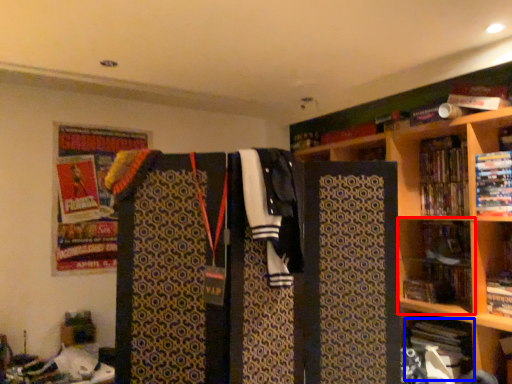
Question: Among these objects, which one is nearest to the camera, shelf (highlighted by a red box) or book (highlighted by a blue box)?

Choices:
 (A) shelf
 (B) book

Answer: (B)